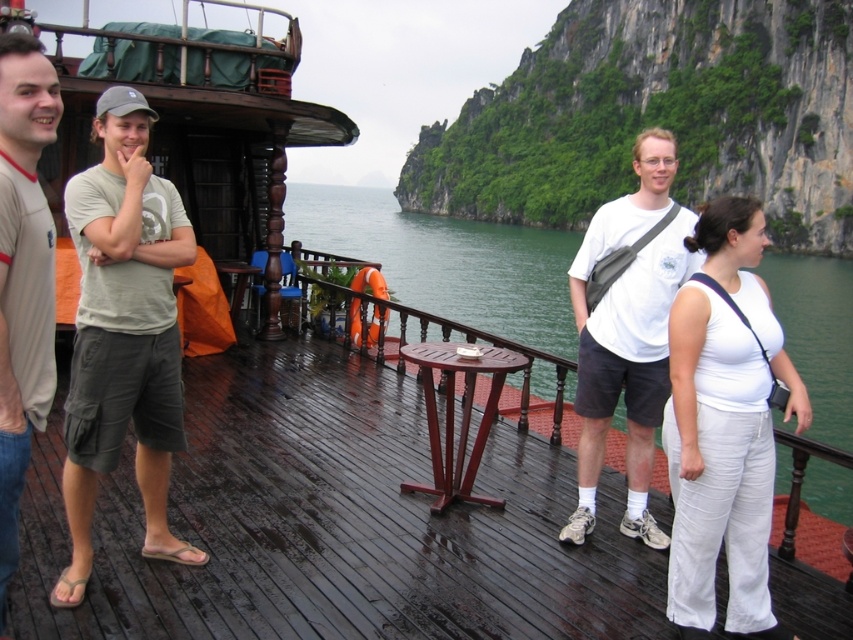
You are a photographer trying to capture a photo of the wooden deck at center and the white matte shirt at center. Which object should you focus on first if you want to include both in the frame without moving the camera?

The wooden deck at center is bigger than the white matte shirt at center, so you should focus on the wooden deck at center first to ensure it fills the frame appropriately before adjusting for the smaller white matte shirt at center.